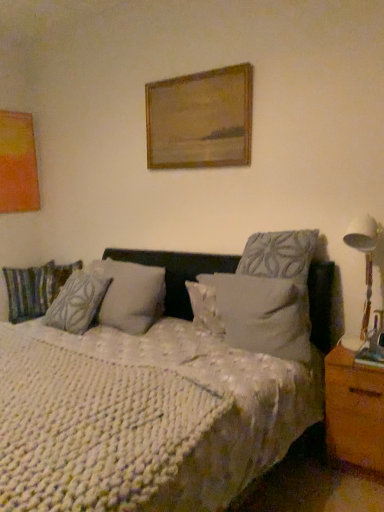
Question: Does textured gray pillow at center, which is the 3th pillow from right to left, have a lesser height compared to white textured pillow at center, the 3th pillow in the left-to-right sequence?

Choices:
 (A) yes
 (B) no

Answer: (B)

Question: Is textured gray pillow at center, which is the second pillow in back-to-front order, smaller than white textured pillow at center, the fourth pillow positioned from the back?

Choices:
 (A) yes
 (B) no

Answer: (B)

Question: Could white textured pillow at center, the 2th pillow in the right-to-left sequence, be considered to be inside textured gray pillow at center, acting as the second pillow starting from the left?

Choices:
 (A) yes
 (B) no

Answer: (B)

Question: Considering the relative sizes of textured gray pillow at center, the 3th pillow positioned from the front, and white textured pillow at center, the fourth pillow positioned from the back, in the image provided, is textured gray pillow at center, the 3th pillow positioned from the front, wider than white textured pillow at center, the fourth pillow positioned from the back,?

Choices:
 (A) yes
 (B) no

Answer: (B)

Question: Are textured gray pillow at center, which is the 3th pillow from right to left, and white textured pillow at center, the 3th pillow in the left-to-right sequence, far apart?

Choices:
 (A) yes
 (B) no

Answer: (B)

Question: Is brown wood nightstand at lower right spatially inside white textured pillow at center, which ranks as the first pillow in front-to-back order, or outside of it?

Choices:
 (A) outside
 (B) inside

Answer: (A)

Question: In terms of height, does brown wood nightstand at lower right look taller or shorter compared to white textured pillow at center, the fourth pillow positioned from the back?

Choices:
 (A) short
 (B) tall

Answer: (B)

Question: In the image, is brown wood nightstand at lower right on the left side or the right side of white textured pillow at center, the 2th pillow in the right-to-left sequence?

Choices:
 (A) left
 (B) right

Answer: (B)

Question: Relative to white textured pillow at center, the 2th pillow in the right-to-left sequence, is brown wood nightstand at lower right in front or behind?

Choices:
 (A) front
 (B) behind

Answer: (A)

Question: Considering their positions, is wooden framed painting at upper center located in front of or behind textured gray pillow at center, the second pillow when ordered from front to back?

Choices:
 (A) front
 (B) behind

Answer: (B)

Question: From a real-world perspective, is wooden framed painting at upper center above or below textured gray pillow at center, positioned as the 4th pillow in left-to-right order?

Choices:
 (A) below
 (B) above

Answer: (B)

Question: Would you say wooden framed painting at upper center is inside or outside textured gray pillow at center, which appears as the first pillow when viewed from the right?

Choices:
 (A) outside
 (B) inside

Answer: (A)

Question: From the image's perspective, is wooden framed painting at upper center above or below textured gray pillow at center, which appears as the first pillow when viewed from the right?

Choices:
 (A) below
 (B) above

Answer: (B)

Question: In terms of height, does white fabric lampshade at right look taller or shorter compared to textured gray pillow at center, the 3th pillow positioned from the front?

Choices:
 (A) short
 (B) tall

Answer: (B)

Question: From a real-world perspective, is white fabric lampshade at right physically located above or below textured gray pillow at center, the 3th pillow positioned from the front?

Choices:
 (A) below
 (B) above

Answer: (B)